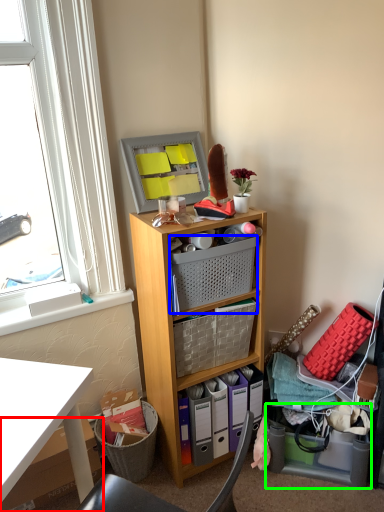
Question: Considering the real-world distances, which object is farthest from box (highlighted by a red box)? basket (highlighted by a blue box) or storage box (highlighted by a green box)?

Choices:
 (A) basket
 (B) storage box

Answer: (B)